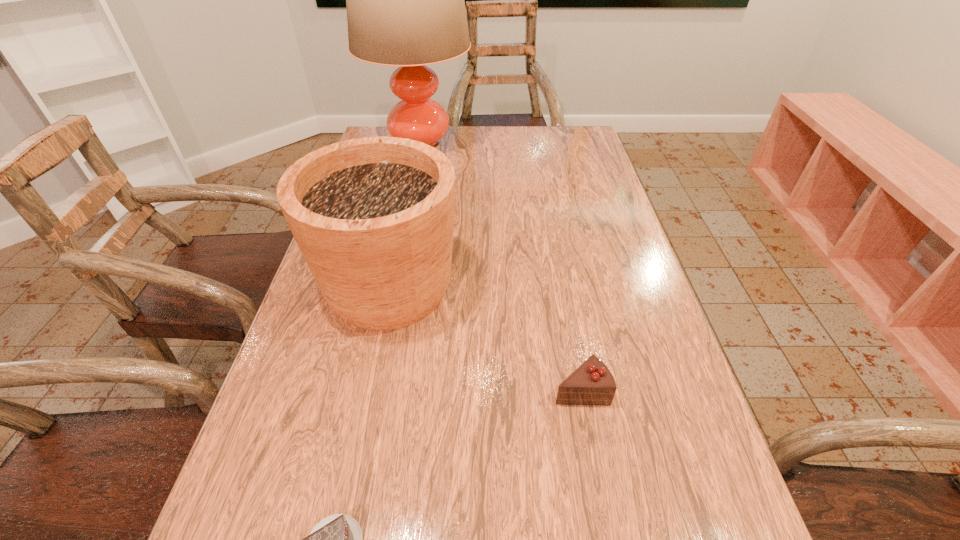
The image size is (960, 540). In order to click on lamp in this screenshot , I will do `click(405, 0)`.

Locate an element on the screen. The height and width of the screenshot is (540, 960). the farthest object is located at coordinates [x=405, y=0].

Where is `the second tallest object`? The image size is (960, 540). the second tallest object is located at coordinates (373, 217).

Where is `flowerpot`? This screenshot has height=540, width=960. flowerpot is located at coordinates (373, 217).

This screenshot has width=960, height=540. What are the coordinates of `the farther chocolate cake` in the screenshot? It's located at (592, 383).

Where is `the right chocolate cake`? the right chocolate cake is located at coordinates (592, 383).

The height and width of the screenshot is (540, 960). Find the location of `blank area located on the front of the farthest object`. blank area located on the front of the farthest object is located at coordinates (414, 186).

This screenshot has height=540, width=960. I want to click on vacant space located on the right of the flowerpot, so click(544, 288).

Locate an element on the screen. The height and width of the screenshot is (540, 960). free space located on the right of the third tallest object is located at coordinates (668, 388).

You are a GUI agent. You are given a task and a screenshot of the screen. Output one action in this format:
    pyautogui.click(x=<x>, y=<y>)
    Task: Click on the object positioned at the far edge
    This screenshot has width=960, height=540.
    Given the screenshot: What is the action you would take?
    pyautogui.click(x=405, y=0)